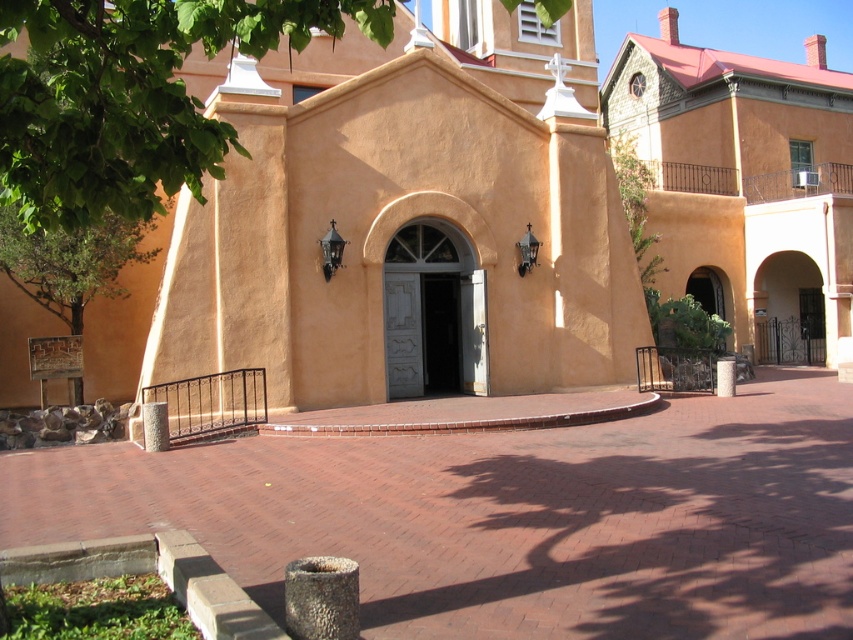
Does white painted wood door at center have a greater height compared to black matte door at center?

Indeed, white painted wood door at center has a greater height compared to black matte door at center.

Between white painted wood door at center and black matte door at center, which one is positioned lower?

black matte door at center is below.

Find the location of a particular element. Image resolution: width=853 pixels, height=640 pixels. white painted wood door at center is located at coordinates (433, 314).

What are the coordinates of `white painted wood door at center` in the screenshot? It's located at (433, 314).

Measure the distance between green leafy tree at upper left and white painted wood door at center.

green leafy tree at upper left and white painted wood door at center are 9.90 meters apart from each other.

Between green leafy tree at upper left and white painted wood door at center, which one is positioned lower?

white painted wood door at center is lower down.

Which is in front, point (155, 90) or point (431, 326)?

Point (155, 90) is more forward.

What are the coordinates of `green leafy tree at upper left` in the screenshot? It's located at (131, 96).

Who is higher up, green leafy tree at upper left or black matte door at center?

green leafy tree at upper left

Does green leafy tree at upper left have a greater height compared to black matte door at center?

In fact, green leafy tree at upper left may be shorter than black matte door at center.

Who is more distant from viewer, (90, 8) or (442, 381)?

Point (442, 381)

You are a GUI agent. You are given a task and a screenshot of the screen. Output one action in this format:
    pyautogui.click(x=<x>, y=<y>)
    Task: Click on the green leafy tree at upper left
    
    Given the screenshot: What is the action you would take?
    pyautogui.click(x=131, y=96)